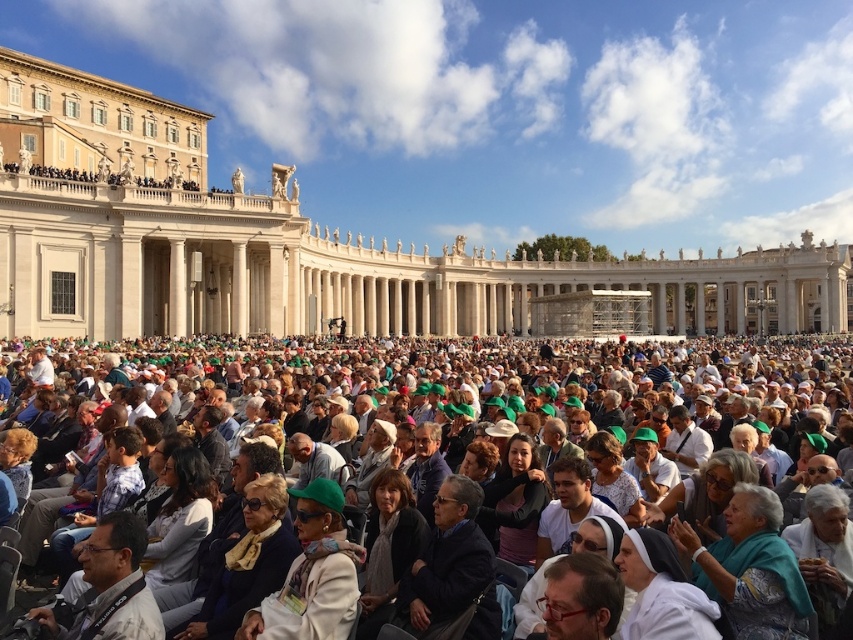
Where is `beige stone palace at center`? beige stone palace at center is located at coordinates (305, 244).

Can you confirm if beige stone palace at center is bigger than green fabric crowd at center?

Yes, beige stone palace at center is bigger than green fabric crowd at center.

Who is more forward, (329, 257) or (534, 531)?

Point (534, 531)

Where is `beige stone palace at center`? This screenshot has height=640, width=853. beige stone palace at center is located at coordinates (305, 244).